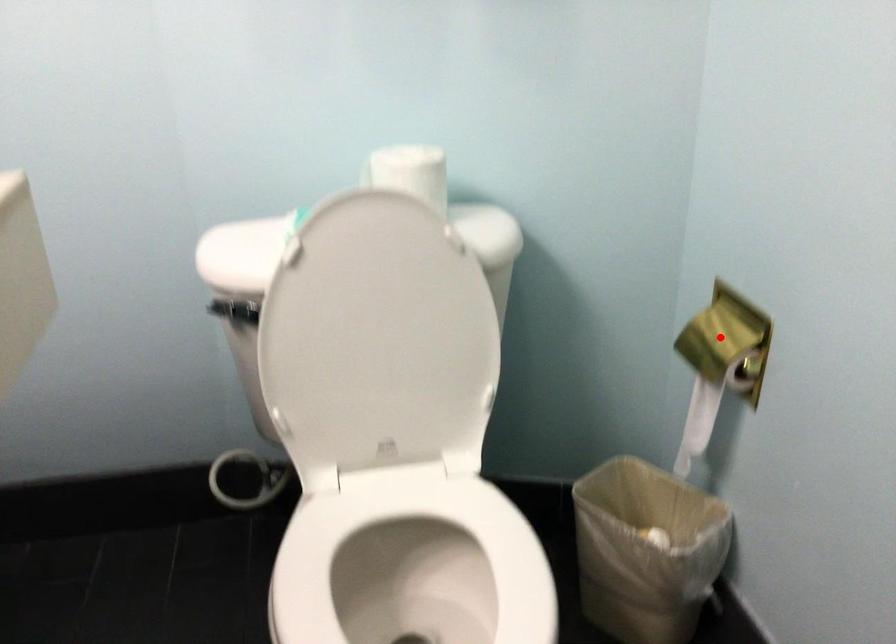
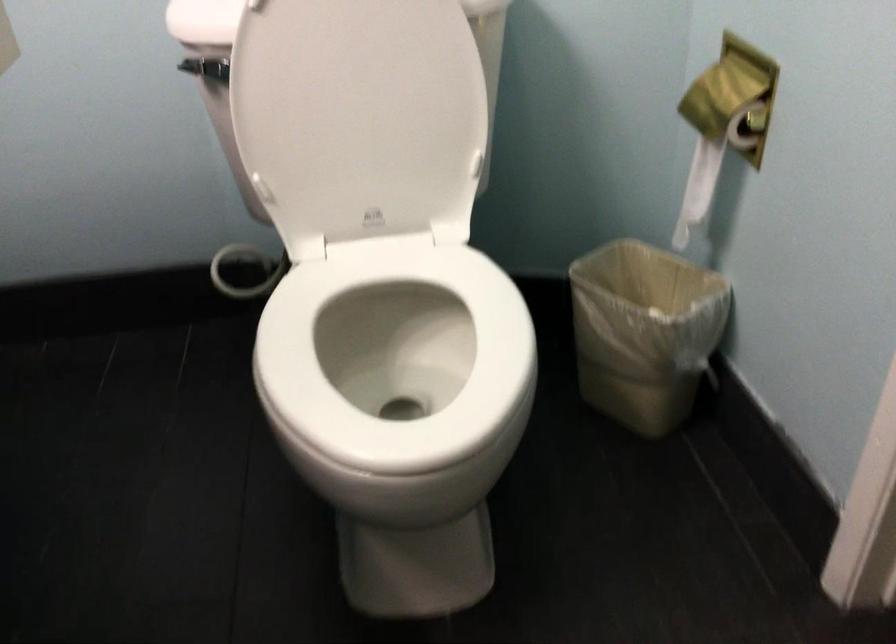
Find the pixel in the second image that matches the highlighted location in the first image.

(722, 91)